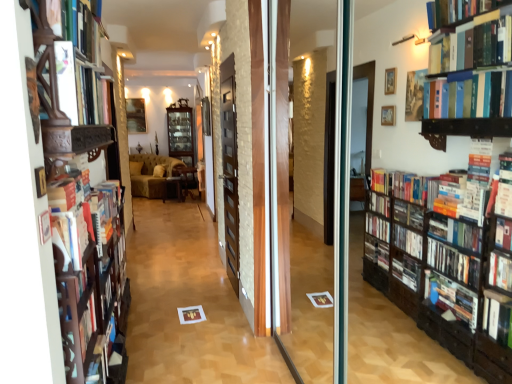
The height and width of the screenshot is (384, 512). In order to click on vacant space behind wooden bookshelf at left in this screenshot , I will do `click(153, 357)`.